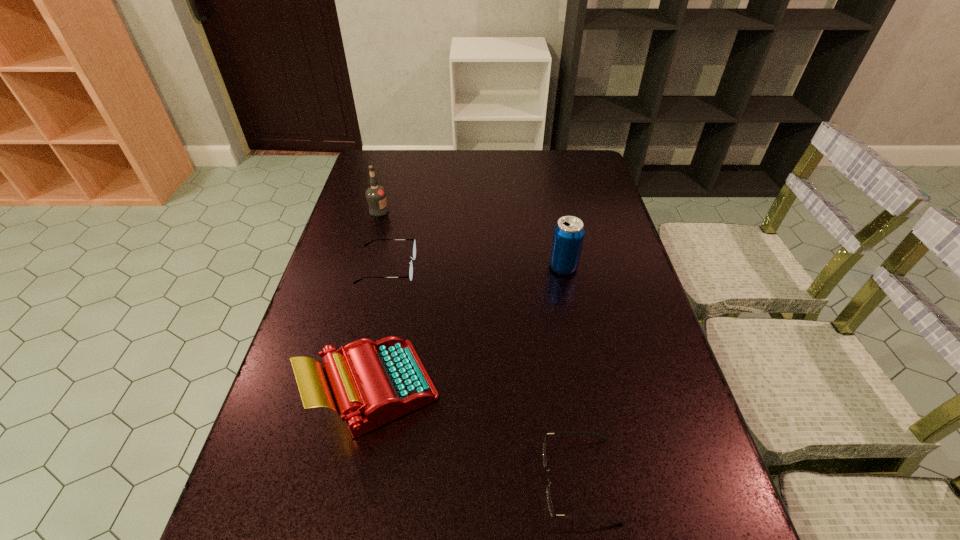
Locate an element on the screen. Image resolution: width=960 pixels, height=540 pixels. free space between the vodka and the shorter spectacles is located at coordinates (479, 345).

Find the location of a particular element. The image size is (960, 540). unoccupied position between the shortest object and the pop soda is located at coordinates (571, 373).

Locate an element on the screen. empty space that is in between the third tallest object and the second shortest object is located at coordinates (381, 328).

At what (x,y) coordinates should I click in order to perform the action: click on the closest object to the typewriter. Please return your answer as a coordinate pair (x, y). Looking at the image, I should click on (413, 257).

Locate which object ranks in proximity to the farther spectacles. Please provide its 2D coordinates. Your answer should be formatted as a tuple, i.e. [(x, y)], where the tuple contains the x and y coordinates of a point satisfying the conditions above.

[(376, 195)]

Locate an element on the screen. The image size is (960, 540). vacant space that satisfies the following two spatial constraints: 1. on the front label of the pop soda; 2. on the left side of the vodka is located at coordinates (364, 267).

This screenshot has height=540, width=960. In order to click on vacant space that satisfies the following two spatial constraints: 1. on the front label of the vodka; 2. on the back side of the pop soda in this screenshot , I will do `click(364, 267)`.